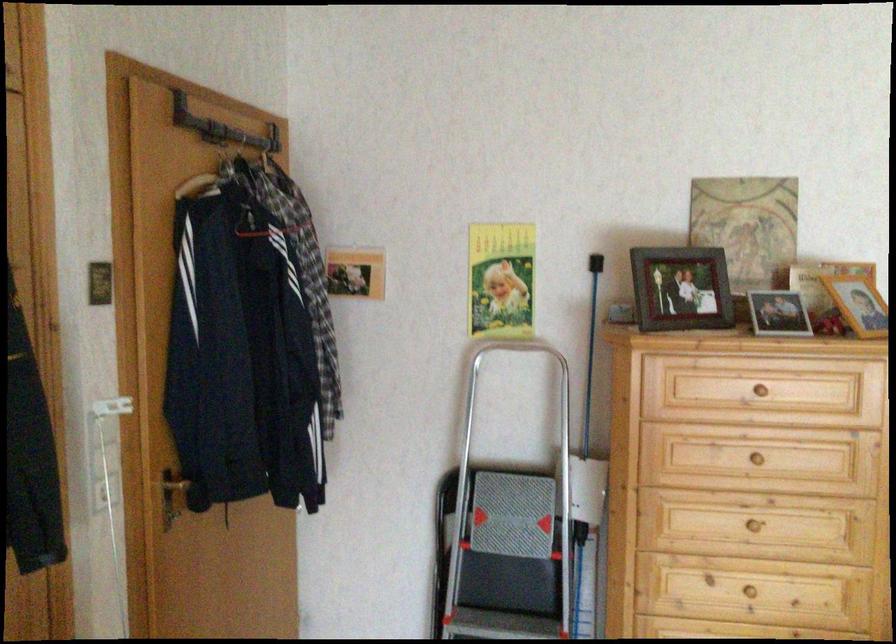
This screenshot has width=896, height=644. What do you see at coordinates (857, 304) in the screenshot?
I see `a light wood frame` at bounding box center [857, 304].